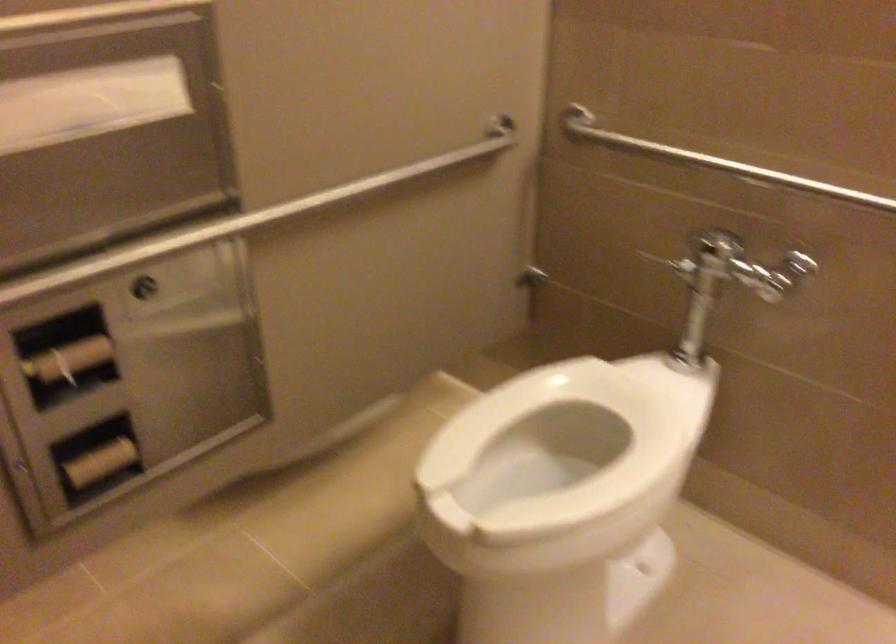
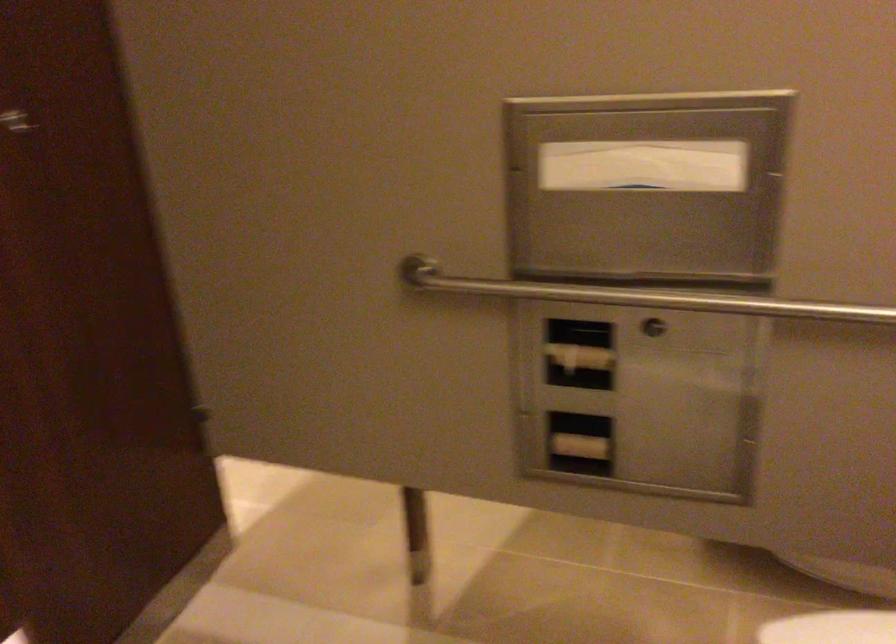
Question: I am providing you with two images of the same scene from different viewpoints. After the viewpoint changes to image2, which objects are now occluded?

Choices:
 (A) paper from dispenser
 (B) toilet paper roll
 (C) metal grab bar
 (D) none of these

Answer: (D)